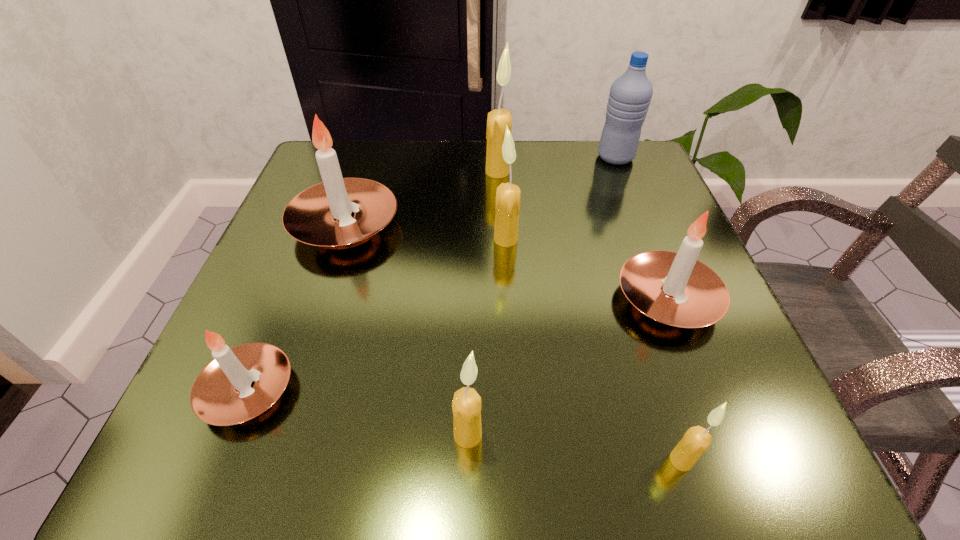
What are the coordinates of `the nearest candle` in the screenshot? It's located at (696, 440).

You are a GUI agent. You are given a task and a screenshot of the screen. Output one action in this format:
    pyautogui.click(x=<x>, y=<y>)
    Task: Click on the rightmost cream candle
    The image size is (960, 540).
    Given the screenshot: What is the action you would take?
    pyautogui.click(x=696, y=440)

Identify the location of free point located 0.100m on the left of the biggest cream candle. This screenshot has height=540, width=960. (441, 172).

This screenshot has width=960, height=540. What are the coordinates of `blank area located 0.330m on the left of the blue water bottle` in the screenshot? It's located at (454, 157).

The image size is (960, 540). I want to click on free space located 0.250m on the right of the farthest white candle, so click(529, 225).

The height and width of the screenshot is (540, 960). I want to click on blank space located 0.200m on the left of the second farthest cream candle, so click(x=386, y=239).

What are the coordinates of `blank space located 0.100m on the back of the fourth nearest candle` in the screenshot? It's located at (639, 227).

You are a GUI agent. You are given a task and a screenshot of the screen. Output one action in this format:
    pyautogui.click(x=<x>, y=<y>)
    Task: Click on the free location located on the left of the third object from left to right
    This screenshot has width=960, height=540.
    Given the screenshot: What is the action you would take?
    pyautogui.click(x=288, y=435)

What are the coordinates of `vacant space located on the back of the smallest white candle` in the screenshot? It's located at pyautogui.click(x=318, y=219).

Identify the location of free location located on the left of the nearest cream candle. (531, 460).